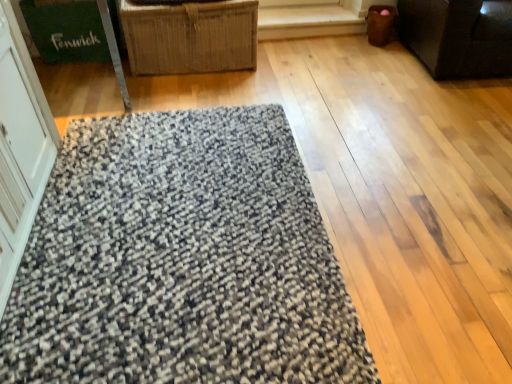
Question: From the image's perspective, is white glossy screen door at left on green cardboard box at upper left?

Choices:
 (A) yes
 (B) no

Answer: (B)

Question: Is there a large distance between white glossy screen door at left and green cardboard box at upper left?

Choices:
 (A) yes
 (B) no

Answer: (A)

Question: Considering the relative sizes of white glossy screen door at left and green cardboard box at upper left in the image provided, is white glossy screen door at left smaller than green cardboard box at upper left?

Choices:
 (A) no
 (B) yes

Answer: (A)

Question: Does white glossy screen door at left contain green cardboard box at upper left?

Choices:
 (A) no
 (B) yes

Answer: (A)

Question: Is the surface of white glossy screen door at left in direct contact with green cardboard box at upper left?

Choices:
 (A) yes
 (B) no

Answer: (B)

Question: Is white glossy screen door at left at the right side of green cardboard box at upper left?

Choices:
 (A) no
 (B) yes

Answer: (B)

Question: From a real-world perspective, is woven straw basket at upper center, which is counted as the first furniture, starting from the left, positioned under white glossy screen door at left based on gravity?

Choices:
 (A) no
 (B) yes

Answer: (B)

Question: Is woven straw basket at upper center, which is counted as the first furniture, starting from the left, oriented towards white glossy screen door at left?

Choices:
 (A) no
 (B) yes

Answer: (B)

Question: Is woven straw basket at upper center, which is counted as the first furniture, starting from the left, far away from white glossy screen door at left?

Choices:
 (A) yes
 (B) no

Answer: (A)

Question: Is white glossy screen door at left located within woven straw basket at upper center, which ranks as the second furniture in right-to-left order?

Choices:
 (A) no
 (B) yes

Answer: (A)

Question: Can you confirm if woven straw basket at upper center, which is counted as the first furniture, starting from the left, is wider than white glossy screen door at left?

Choices:
 (A) no
 (B) yes

Answer: (B)

Question: From the image's perspective, is woven straw basket at upper center, which is counted as the first furniture, starting from the left, located above white glossy screen door at left?

Choices:
 (A) no
 (B) yes

Answer: (B)

Question: Is textured gray mat at center completely or partially outside of woven straw basket at upper center, which is counted as the first furniture, starting from the left?

Choices:
 (A) yes
 (B) no

Answer: (A)